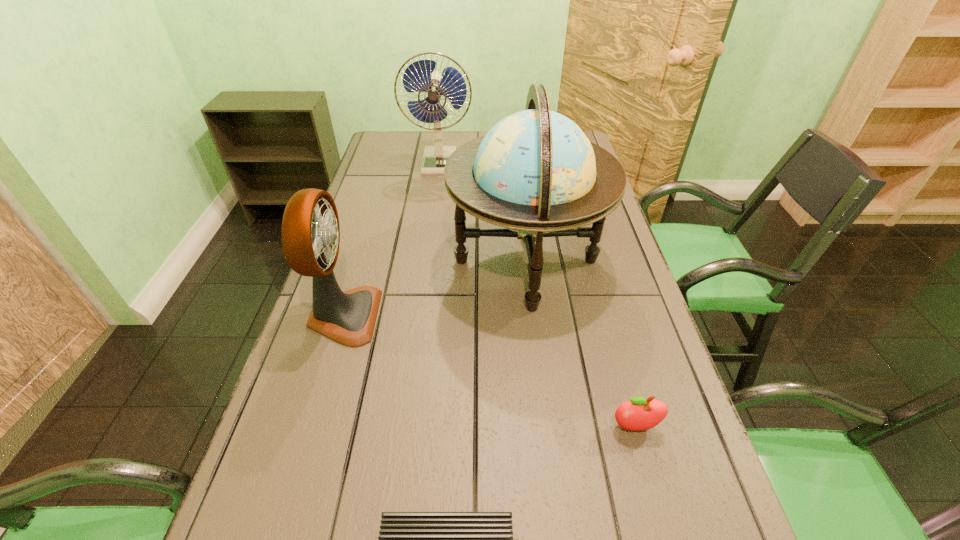
You are a GUI agent. You are given a task and a screenshot of the screen. Output one action in this format:
    pyautogui.click(x=<x>, y=<y>)
    Task: Click on the vacant space that's between the apple and the globe
    Image resolution: width=960 pixels, height=540 pixels.
    Given the screenshot: What is the action you would take?
    (581, 344)

Identify the location of vacant region between the nearer fan and the farther fan. (392, 240).

Identify the location of object that is the third closest to the farthest object. (638, 414).

Locate which object is the third closest to the fourth tallest object. Please provide its 2D coordinates. Your answer should be formatted as a tuple, i.e. [(x, y)], where the tuple contains the x and y coordinates of a point satisfying the conditions above.

[(310, 232)]

This screenshot has width=960, height=540. I want to click on free space that satisfies the following two spatial constraints: 1. on the front-facing side of the shorter fan; 2. on the right side of the apple, so click(x=310, y=427).

Identify the location of free space in the image that satisfies the following two spatial constraints: 1. on the front-facing side of the nearer fan; 2. on the back side of the second nearest object. (310, 427).

Find the location of `free space that satisfies the following two spatial constraints: 1. on the surface of the second shortest object; 2. on the left side of the globe`. free space that satisfies the following two spatial constraints: 1. on the surface of the second shortest object; 2. on the left side of the globe is located at coordinates (545, 427).

Where is `free space that satisfies the following two spatial constraints: 1. on the front-facing side of the farthest object; 2. on the front-facing side of the shorter fan`? The width and height of the screenshot is (960, 540). free space that satisfies the following two spatial constraints: 1. on the front-facing side of the farthest object; 2. on the front-facing side of the shorter fan is located at coordinates (419, 316).

Identify the location of vacant space that satisfies the following two spatial constraints: 1. on the front-facing side of the third tallest object; 2. on the right side of the fourth tallest object. (310, 427).

Locate an element on the screen. This screenshot has height=540, width=960. free region that satisfies the following two spatial constraints: 1. on the surface of the fourth tallest object; 2. on the right side of the tallest object is located at coordinates [545, 427].